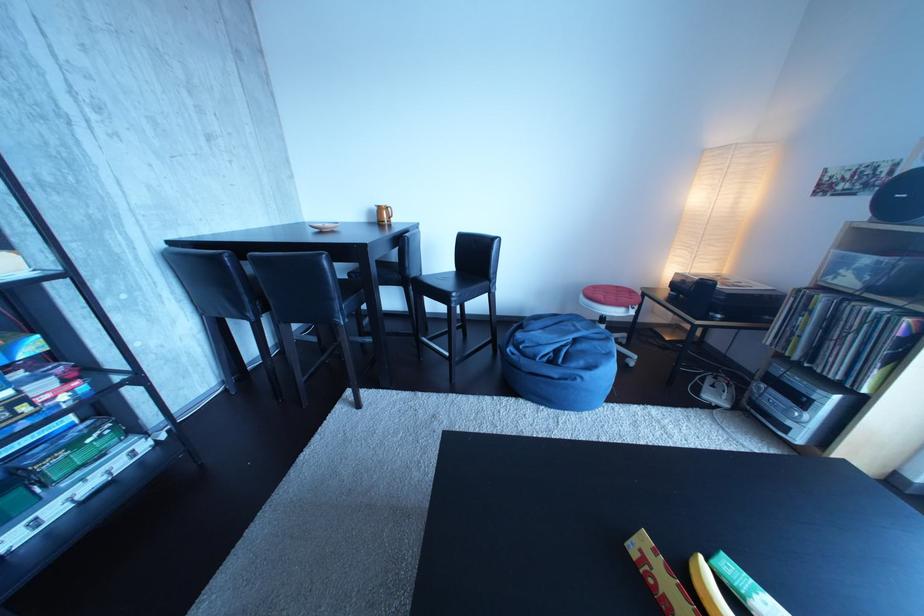
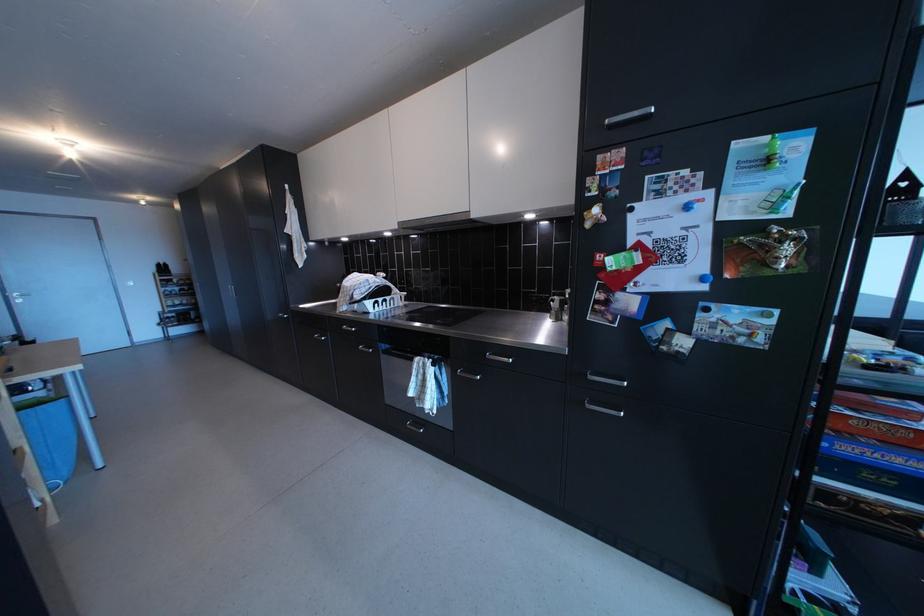
Question: In a continuous first-person perspective shot, in which direction is the camera moving?

Choices:
 (A) Left
 (B) Right
 (C) Forward
 (D) Backward

Answer: (A)